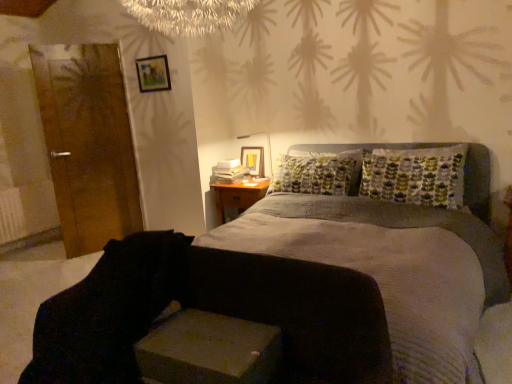
The image size is (512, 384). Describe the element at coordinates (88, 144) in the screenshot. I see `wooden door at left` at that location.

I want to click on textured gray bed at center, so click(x=211, y=310).

The image size is (512, 384). In order to click on white plastic table lamp at upper center in this screenshot , I will do `click(267, 146)`.

This screenshot has height=384, width=512. What do you see at coordinates (237, 195) in the screenshot?
I see `woodennightstand at right` at bounding box center [237, 195].

This screenshot has height=384, width=512. I want to click on black fabric swivel chair at lower left, so click(x=106, y=312).

Is wooden door at left oriented away from black fabric swivel chair at lower left?

No, wooden door at left is not facing the opposite direction of black fabric swivel chair at lower left.

Is wooden door at left shorter than black fabric swivel chair at lower left?

No.

Would you consider wooden door at left to be distant from black fabric swivel chair at lower left?

That's right, there is a large distance between wooden door at left and black fabric swivel chair at lower left.

From the image's perspective, between wooden door at left and black fabric swivel chair at lower left, which one is located above?

From the image's view, wooden door at left is above.

The image size is (512, 384). Identify the location of picture frame above the textured gray bed at center (from a real-world perspective). (153, 74).

Between textured gray bed at center and wooden frame at upper left, which one has more height?

With more height is textured gray bed at center.

Does textured gray bed at center turn towards wooden frame at upper left?

No, textured gray bed at center is not oriented towards wooden frame at upper left.

The height and width of the screenshot is (384, 512). I want to click on picture frame above the textured gray bed at center (from the image's perspective), so click(x=153, y=74).

Considering the positions of point (166, 69) and point (314, 360), is point (166, 69) closer or farther from the camera than point (314, 360)?

Point (166, 69) is positioned farther from the camera compared to point (314, 360).

Measure the distance between wooden frame at upper left and textured gray bed at center.

wooden frame at upper left and textured gray bed at center are 2.53 meters apart.

In the image, is wooden frame at upper left positioned in front of or behind textured gray bed at center?

wooden frame at upper left is positioned farther from the viewer than textured gray bed at center.

In the scene shown: Measure the distance from white plastic table lamp at upper center to wooden door at left.

4.98 feet.

Can you confirm if white plastic table lamp at upper center is wider than wooden door at left?

Indeed, white plastic table lamp at upper center has a greater width compared to wooden door at left.

Which object is closer to the camera taking this photo, white plastic table lamp at upper center or wooden door at left?

wooden door at left is more forward.

From a real-world perspective, relative to wooden door at left, is white plastic table lamp at upper center vertically above or below?

In terms of real-world spatial position, white plastic table lamp at upper center is below wooden door at left.

From a real-world perspective, is black fabric swivel chair at lower left physically above woodennightstand at right?

Yes.

From the picture: Between black fabric swivel chair at lower left and woodennightstand at right, which one has smaller size?

woodennightstand at right.

What's the angular difference between black fabric swivel chair at lower left and woodennightstand at right's facing directions?

2.55 degrees separate the facing orientations of black fabric swivel chair at lower left and woodennightstand at right.

In the scene shown: From the image's perspective, does black fabric swivel chair at lower left appear higher than woodennightstand at right?

Incorrect, from the image's perspective, black fabric swivel chair at lower left is lower than woodennightstand at right.

From a real-world perspective, which object stands above the other?

wooden door at left.

Between black fabric swivel chair at lower left and wooden door at left, which one appears on the left side from the viewer's perspective?

wooden door at left is more to the left.

Is point (73, 309) closer or farther from the camera than point (75, 125)?

Point (73, 309) is closer to the camera than point (75, 125).

Would you say black fabric swivel chair at lower left is a long distance from wooden door at left?

Indeed, black fabric swivel chair at lower left is not near wooden door at left.

Is black fabric swivel chair at lower left not near textured gray bed at center?

That's not correct — black fabric swivel chair at lower left is a little close to textured gray bed at center.

Looking at this image, does black fabric swivel chair at lower left appear on the left side of textured gray bed at center?

Indeed, black fabric swivel chair at lower left is positioned on the left side of textured gray bed at center.

From the image's perspective, is black fabric swivel chair at lower left on top of textured gray bed at center?

No, from the image's perspective, black fabric swivel chair at lower left is not over textured gray bed at center.

What are the coordinates of `armoire above the black fabric swivel chair at lower left (from the image's perspective)` in the screenshot? It's located at (88, 144).

I want to click on bed located on the right of wooden frame at upper left, so click(211, 310).

Based on their spatial positions, is textured gray bed at center or wooden door at left further from wooden frame at upper left?

Among the two, textured gray bed at center is located further to wooden frame at upper left.

Estimate the real-world distances between objects in this image. Which object is further from textured gray bed at center, wooden door at left or white plastic table lamp at upper center?

Among the two, wooden door at left is located further to textured gray bed at center.

When comparing their distances from white plastic table lamp at upper center, does woodennightstand at right or black fabric swivel chair at lower left seem further?

Based on the image, black fabric swivel chair at lower left appears to be further to white plastic table lamp at upper center.

Estimate the real-world distances between objects in this image. Which object is closer to wooden frame at upper left, wooden door at left or black fabric swivel chair at lower left?

wooden door at left is positioned closer to the anchor wooden frame at upper left.

From the image, which object appears to be farther from woodennightstand at right, wooden frame at upper left or textured gray bed at center?

Based on the image, textured gray bed at center appears to be further to woodennightstand at right.

Based on their spatial positions, is wooden frame at upper left or textured gray bed at center closer to white plastic table lamp at upper center?

wooden frame at upper left is positioned closer to the anchor white plastic table lamp at upper center.

Looking at the image, which one is located closer to textured gray bed at center, wooden frame at upper left or white plastic table lamp at upper center?

white plastic table lamp at upper center is closer to textured gray bed at center.

From the picture: Which object lies nearer to the anchor point white plastic table lamp at upper center, wooden frame at upper left or woodennightstand at right?

Among the two, woodennightstand at right is located nearer to white plastic table lamp at upper center.

Identify the location of armoire between textured gray bed at center and white plastic table lamp at upper center along the z-axis. (88, 144).

This screenshot has width=512, height=384. What are the coordinates of `picture frame located between wooden door at left and woodennightstand at right in the left-right direction` in the screenshot? It's located at (153, 74).

Identify the location of nightstand between black fabric swivel chair at lower left and wooden frame at upper left along the z-axis. (237, 195).

Find the location of a particular element. nightstand located between textured gray bed at center and wooden frame at upper left in the depth direction is located at coordinates (237, 195).